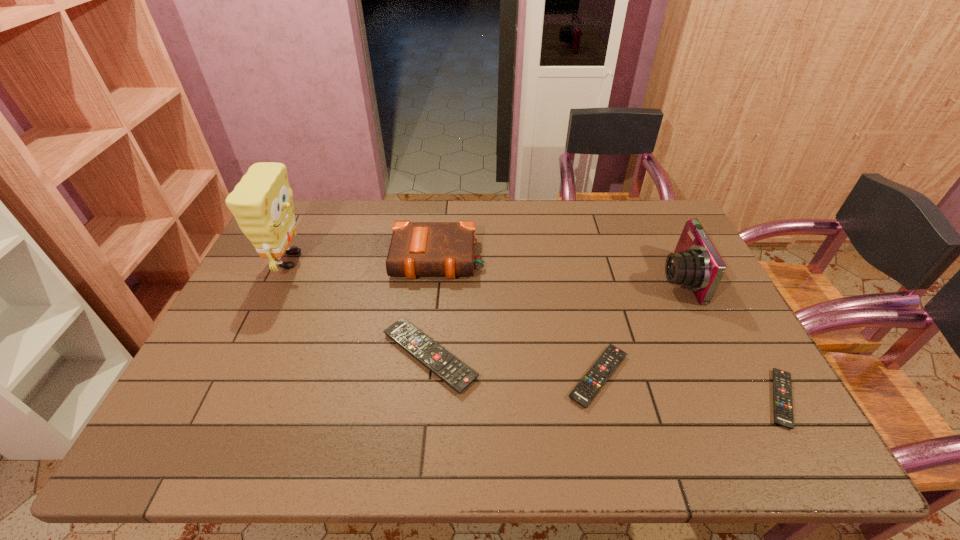
You are a GUI agent. You are given a task and a screenshot of the screen. Output one action in this format:
    pyautogui.click(x=<x>, y=<y>)
    Task: Click on the sponge present at the far edge
    
    Given the screenshot: What is the action you would take?
    pyautogui.click(x=261, y=202)

This screenshot has height=540, width=960. Identify the location of object located in the left edge section of the desktop. (261, 202).

The image size is (960, 540). What are the coordinates of `remote control that is at the right edge` in the screenshot? It's located at point(782,388).

Where is `camera that is at the right edge`? camera that is at the right edge is located at coordinates (695, 264).

This screenshot has width=960, height=540. In order to click on object present at the far left corner in this screenshot , I will do `click(261, 202)`.

Where is `object situated at the near right corner`? The image size is (960, 540). object situated at the near right corner is located at coordinates (782, 388).

The width and height of the screenshot is (960, 540). Find the location of `vacant space at the far edge of the desktop`. vacant space at the far edge of the desktop is located at coordinates (636, 234).

What are the coordinates of `vacant space at the near edge of the desktop` in the screenshot? It's located at (691, 382).

Where is `vacant space at the left edge of the desktop`? Image resolution: width=960 pixels, height=540 pixels. vacant space at the left edge of the desktop is located at coordinates (238, 339).

This screenshot has width=960, height=540. What are the coordinates of `vacant space at the far left corner of the desktop` in the screenshot? It's located at (304, 207).